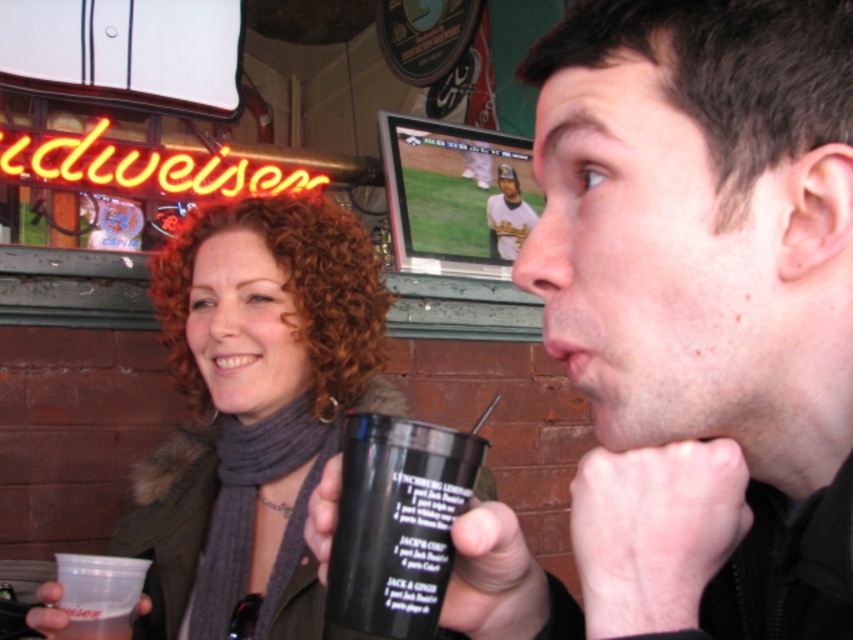
Where is `matte black cup at right`? matte black cup at right is located at coordinates (701, 307).

What do you see at coordinates (701, 307) in the screenshot? The height and width of the screenshot is (640, 853). I see `matte black cup at right` at bounding box center [701, 307].

Image resolution: width=853 pixels, height=640 pixels. I want to click on matte black cup at right, so click(701, 307).

You are a GUI agent. You are given a task and a screenshot of the screen. Output one action in this format:
    pyautogui.click(x=<x>, y=<y>)
    Task: Click on the matte black cup at right
    Image resolution: width=853 pixels, height=640 pixels.
    Given the screenshot: What is the action you would take?
    pyautogui.click(x=701, y=307)

Is matte black cup at right taller than matte black cup at center?

No, matte black cup at right is not taller than matte black cup at center.

This screenshot has width=853, height=640. What are the coordinates of `matte black cup at right` in the screenshot? It's located at (701, 307).

The height and width of the screenshot is (640, 853). I want to click on matte black cup at right, so click(x=701, y=307).

Locate an element on the screen. matte black cup at right is located at coordinates (701, 307).

Is point (727, 368) behind point (509, 228)?

No, it is in front of (509, 228).

Who is higher up, matte black cup at right or white jersey baseball player at upper center?

Positioned higher is white jersey baseball player at upper center.

What do you see at coordinates (701, 307) in the screenshot? The image size is (853, 640). I see `matte black cup at right` at bounding box center [701, 307].

Where is `matte black cup at right`? This screenshot has width=853, height=640. matte black cup at right is located at coordinates (701, 307).